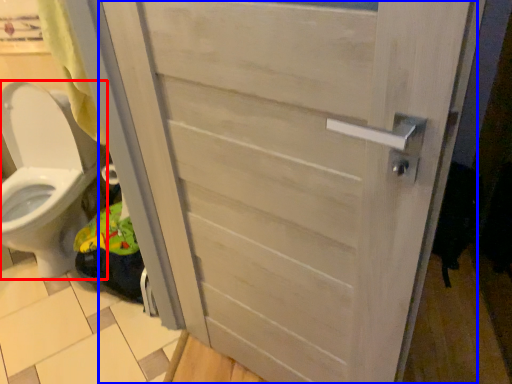
Question: Which object appears farthest to the camera in this image, toilet (highlighted by a red box) or door (highlighted by a blue box)?

Choices:
 (A) toilet
 (B) door

Answer: (A)